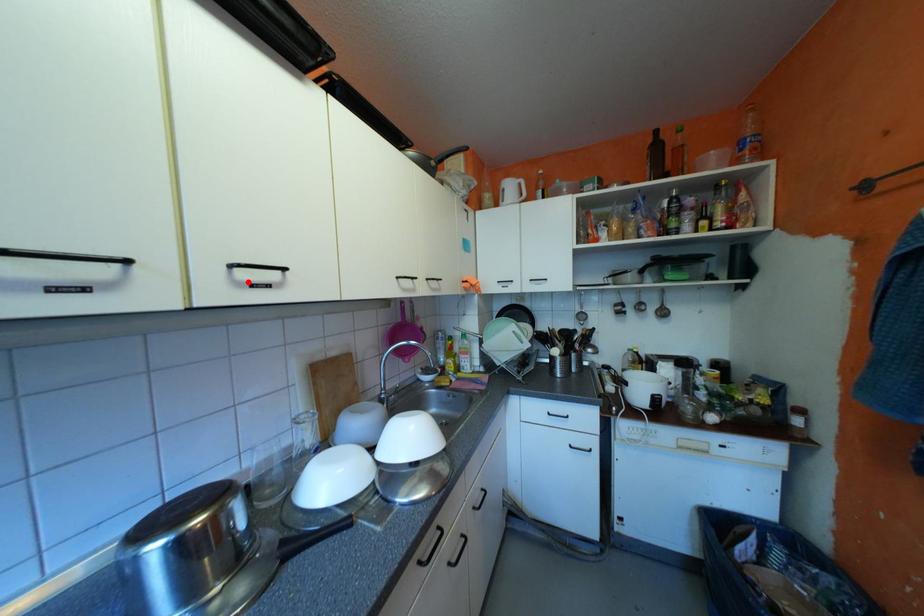
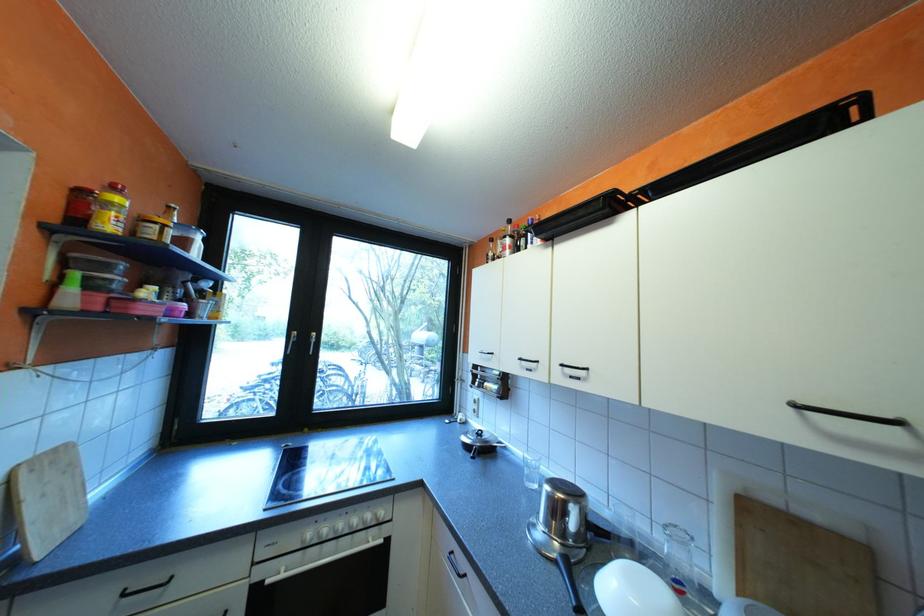
Where in the second image is the point corresponding to the highlighted location from the first image?

(576, 373)